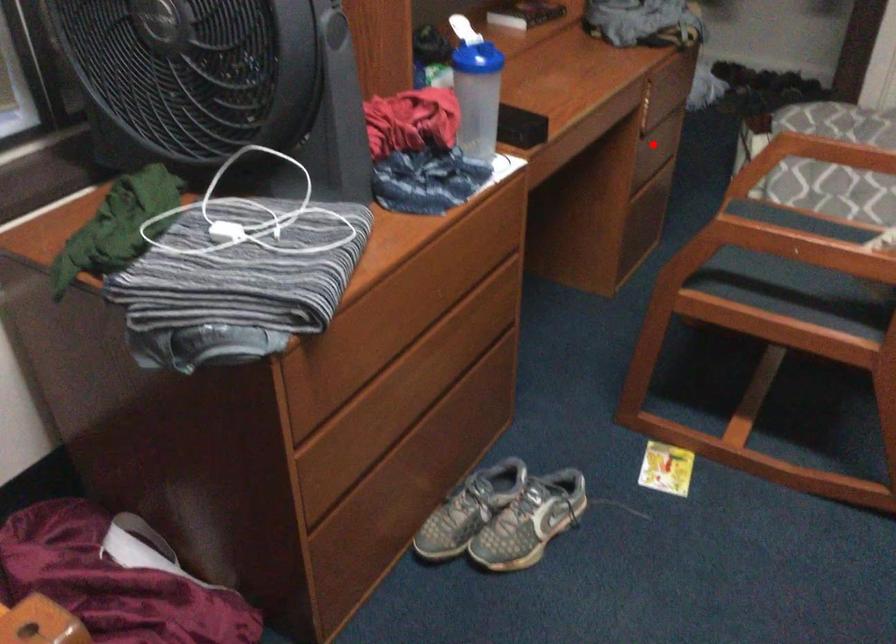
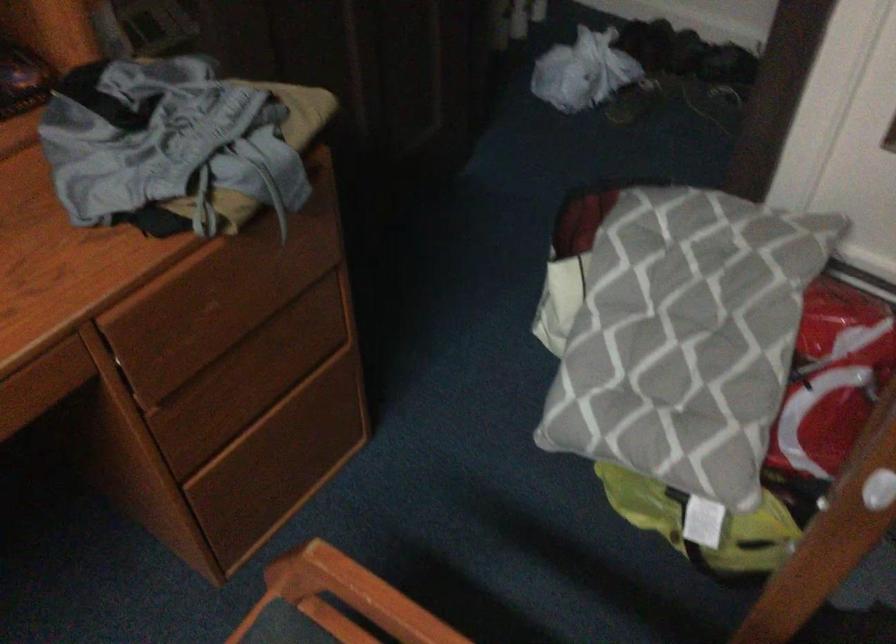
The point at the highlighted location is marked in the first image. Where is the corresponding point in the second image?

(254, 377)